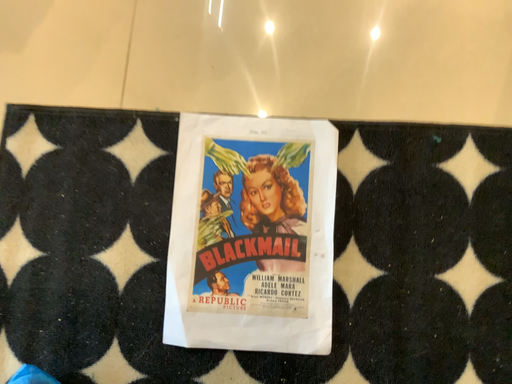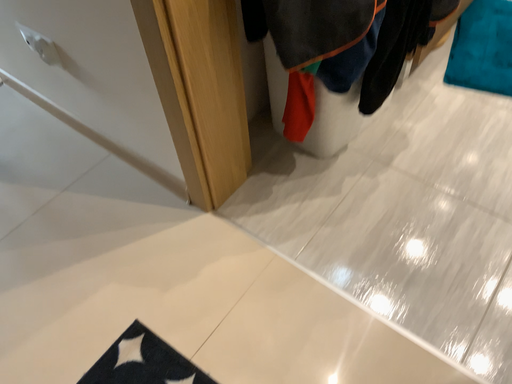
Question: Which way did the camera rotate in the video?

Choices:
 (A) rotated upward
 (B) rotated downward

Answer: (A)